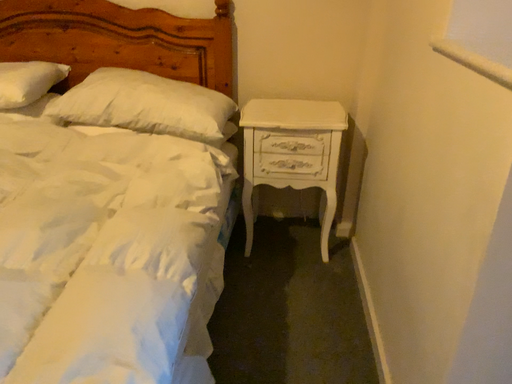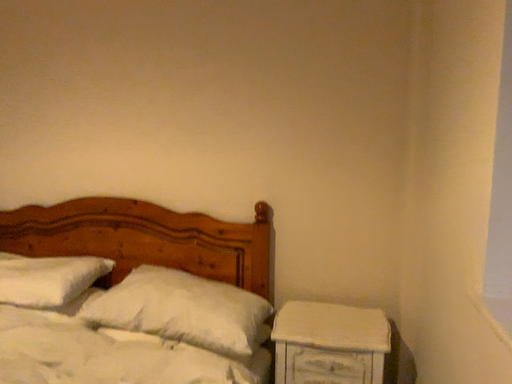
Question: How did the camera likely rotate when shooting the video?

Choices:
 (A) rotated left
 (B) rotated right

Answer: (A)